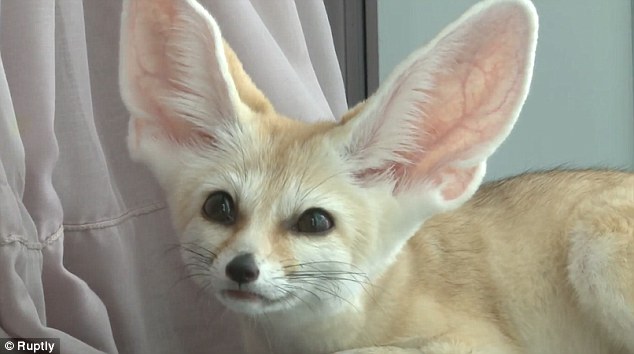
This screenshot has width=634, height=354. Find the location of `curtain`. curtain is located at coordinates (54, 103).